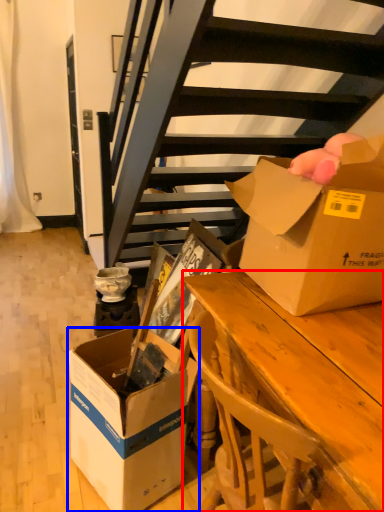
Question: Among these objects, which one is farthest to the camera, desk (highlighted by a red box) or box (highlighted by a blue box)?

Choices:
 (A) desk
 (B) box

Answer: (B)